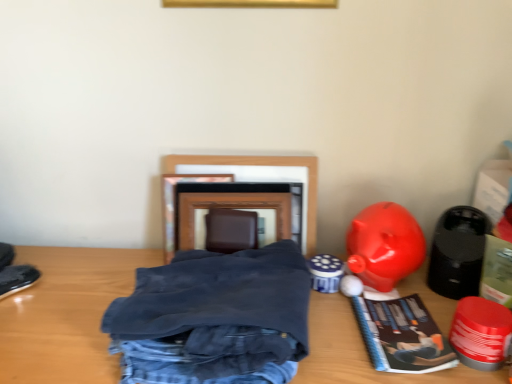
You are a GUI agent. You are given a task and a screenshot of the screen. Output one action in this format:
    pyautogui.click(x=<x>, y=<y>)
    Task: Click on the empty space that is in between matte paper book at lower right and dark blue cotton pants at center
    This screenshot has height=384, width=512.
    Given the screenshot: What is the action you would take?
    pyautogui.click(x=339, y=340)